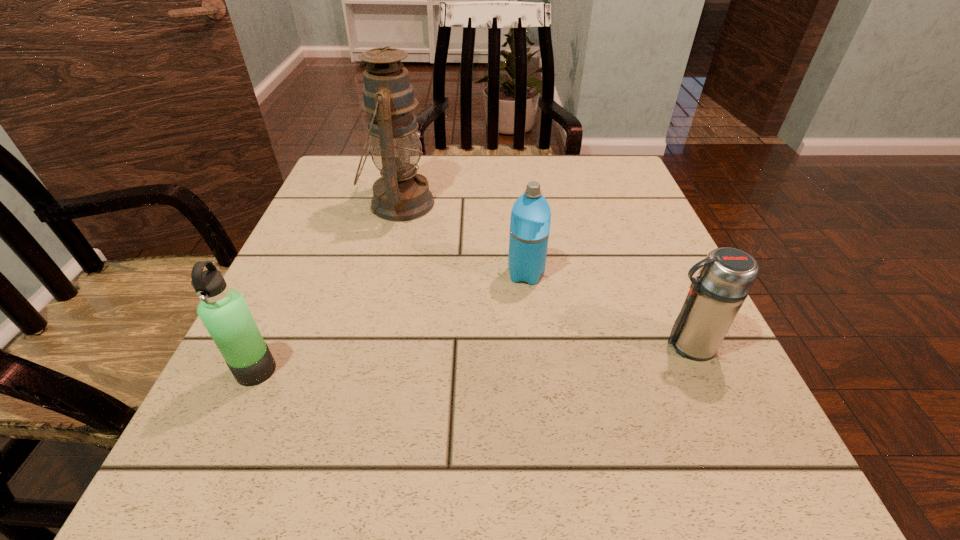
You are a GUI agent. You are given a task and a screenshot of the screen. Output one action in this format:
    pyautogui.click(x=<x>, y=<y>)
    Task: Click on the vacant point located between the rightmost thermos bottle and the third object from left to right
    The width and height of the screenshot is (960, 540).
    Given the screenshot: What is the action you would take?
    pyautogui.click(x=607, y=309)

I want to click on unoccupied area between the rightmost object and the leftmost object, so click(472, 357).

You are a GUI agent. You are given a task and a screenshot of the screen. Output one action in this format:
    pyautogui.click(x=<x>, y=<y>)
    Task: Click on the free area in between the farthest thermos bottle and the leftmost object
    
    Given the screenshot: What is the action you would take?
    pyautogui.click(x=391, y=322)

The height and width of the screenshot is (540, 960). What are the coordinates of `vacant area between the tallest object and the rightmost object` in the screenshot? It's located at (543, 274).

Locate an element on the screen. object that stands as the closest to the farthest thermos bottle is located at coordinates (401, 194).

Locate an element on the screen. the second closest object to the second object from left to right is located at coordinates (223, 311).

Point out which thermos bottle is positioned as the nearest to the farthest thermos bottle. Please provide its 2D coordinates. Your answer should be formatted as a tuple, i.e. [(x, y)], where the tuple contains the x and y coordinates of a point satisfying the conditions above.

[(727, 275)]

This screenshot has height=540, width=960. I want to click on thermos bottle that is the second closest one to the farthest thermos bottle, so click(223, 311).

Find the location of a particular element. This screenshot has width=960, height=540. free location that satisfies the following two spatial constraints: 1. on the front side of the second thermos bottle from right to left; 2. on the left side of the tallest object is located at coordinates (382, 274).

The height and width of the screenshot is (540, 960). Find the location of `free region that satisfies the following two spatial constraints: 1. with a handle on the side of the rightmost thermos bottle; 2. on the front side of the leftmost object`. free region that satisfies the following two spatial constraints: 1. with a handle on the side of the rightmost thermos bottle; 2. on the front side of the leftmost object is located at coordinates (700, 370).